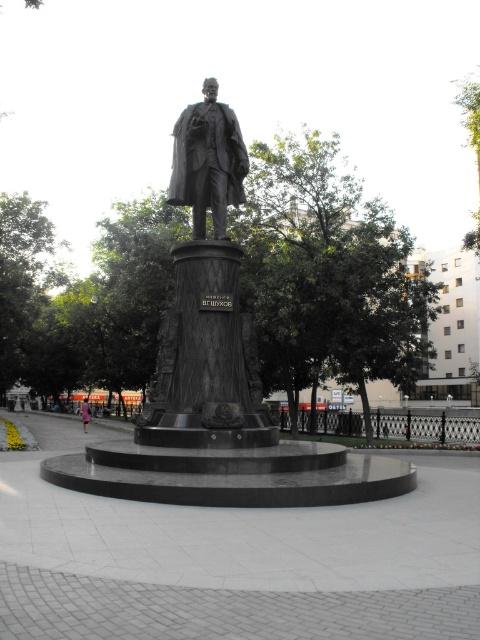
Question: Can you confirm if polished bronze statue at center is positioned below pink fabric dress at center?

Choices:
 (A) yes
 (B) no

Answer: (B)

Question: Which object is positioned farthest from the polished bronze statue at center?

Choices:
 (A) bronze statue at center
 (B) pink fabric dress at center

Answer: (B)

Question: Which point appears farthest from the camera in this image?

Choices:
 (A) (85, 397)
 (B) (232, 394)

Answer: (A)

Question: Which point is farther to the camera?

Choices:
 (A) (88, 410)
 (B) (252, 417)

Answer: (A)

Question: Does polished bronze statue at center have a lesser width compared to pink fabric dress at center?

Choices:
 (A) yes
 (B) no

Answer: (A)

Question: Can you confirm if polished bronze statue at center is wider than pink fabric dress at center?

Choices:
 (A) no
 (B) yes

Answer: (A)